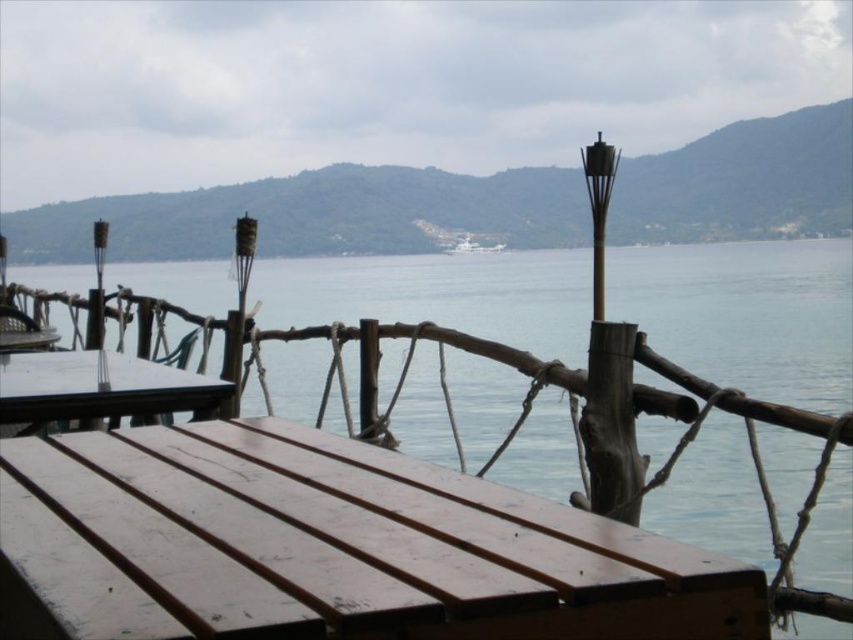
You are planning to host a small gathering and need to seat 8 people. You have access to both the wooden bench at lower left and the wooden picnic table at center. Which object would be more suitable for seating more people?

The wooden picnic table at center is more suitable for seating more people because its width is greater than the wooden bench at lower left.

You are planning to host a small gathering on the wooden deck. You have a 3m long table that needs to be placed between the wooden bench at lower left and the white glossy boat at center. Based on their sizes, can the table fit between them?

The wooden bench at lower left is bigger than the white glossy boat at center, but without knowing their exact dimensions, it is impossible to determine if the 3m table can fit between them.